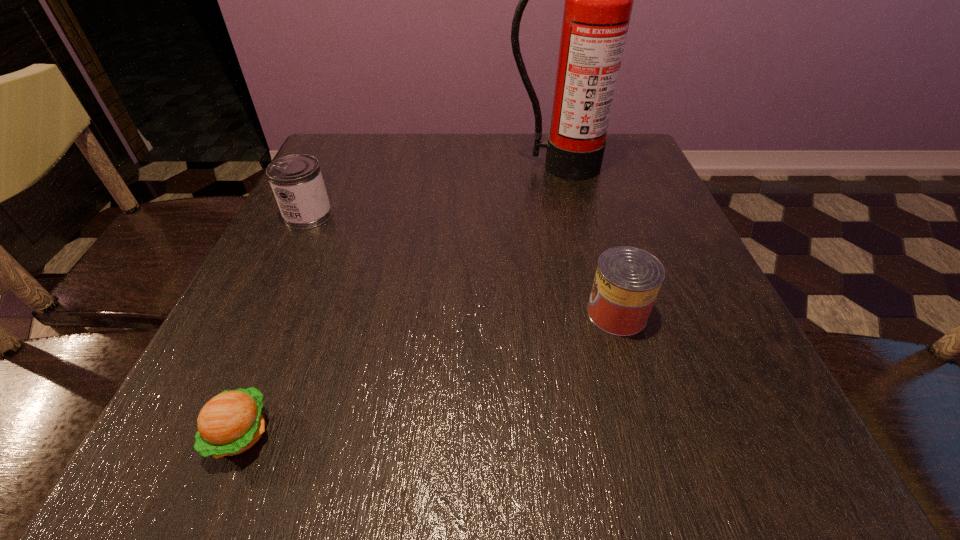
In the image, there is a desktop. At what (x,y) coordinates should I click in order to perform the action: click on free region at the far edge. Please return your answer as a coordinate pair (x, y). Looking at the image, I should click on (395, 152).

At what (x,y) coordinates should I click in order to perform the action: click on blank area at the left edge. Please return your answer as a coordinate pair (x, y). This screenshot has width=960, height=540. Looking at the image, I should click on (336, 210).

Locate an element on the screen. The width and height of the screenshot is (960, 540). vacant area at the right edge is located at coordinates (675, 306).

At what (x,y) coordinates should I click in order to perform the action: click on blank space at the far left corner. Please return your answer as a coordinate pair (x, y). This screenshot has width=960, height=540. Looking at the image, I should click on (347, 178).

This screenshot has height=540, width=960. What are the coordinates of `vacant area between the third nearest object and the tallest object` in the screenshot? It's located at (434, 191).

Locate an element on the screen. The height and width of the screenshot is (540, 960). vacant space that's between the shortest object and the nearer can is located at coordinates (428, 373).

Identify the location of free space that is in between the farthest object and the hamburger. This screenshot has height=540, width=960. (399, 300).

I want to click on vacant region between the farthest object and the hamburger, so click(x=399, y=300).

Locate an element on the screen. The height and width of the screenshot is (540, 960). free space between the nearer can and the hamburger is located at coordinates (428, 373).

At what (x,y) coordinates should I click in order to perform the action: click on vacant space that is in between the farther can and the hamburger. Please return your answer as a coordinate pair (x, y). This screenshot has width=960, height=540. Looking at the image, I should click on (275, 324).